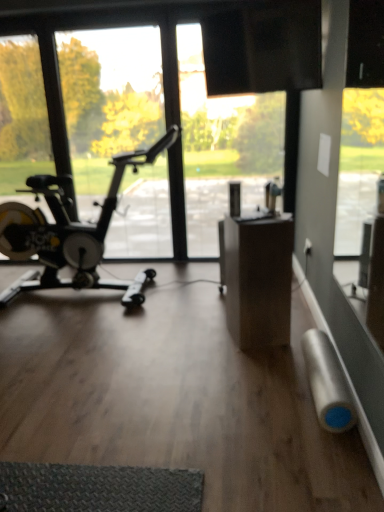
This screenshot has width=384, height=512. I want to click on free spot above silver matte duct tape at lower right (from a real-world perspective), so click(323, 352).